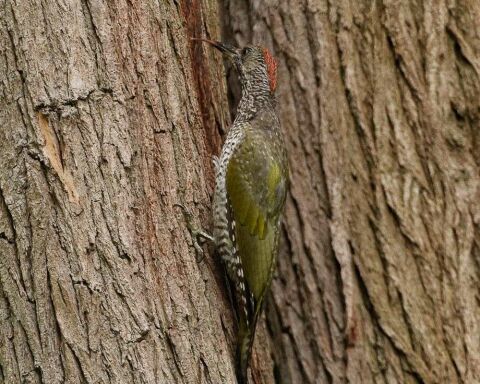
This screenshot has width=480, height=384. I want to click on white black speckled chest, so pos(234,138).